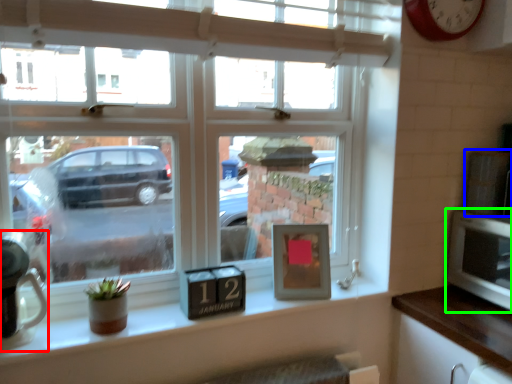
Question: Which object is the closest to the appliance (highlighted by a red box)? Choose among these: appliance (highlighted by a blue box) or microwave (highlighted by a green box).

Choices:
 (A) appliance
 (B) microwave

Answer: (B)